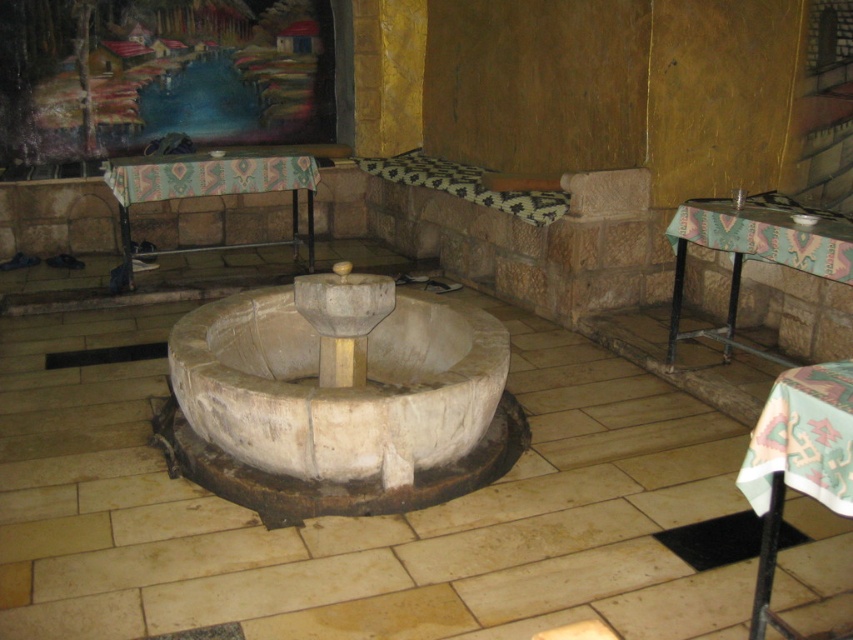
Question: Which is nearer to the patterned fabric table at lower right?

Choices:
 (A) teal woven tablecloth at upper center
 (B) smooth stone fountain at center
 (C) patterned fabric table at left

Answer: (B)

Question: Which object is positioned farthest from the smooth stone fountain at center?

Choices:
 (A) patterned fabric table at left
 (B) patterned fabric table at lower right

Answer: (A)

Question: Is smooth stone fountain at center wider than teal woven tablecloth at upper center?

Choices:
 (A) yes
 (B) no

Answer: (A)

Question: Is smooth stone fountain at center closer to the viewer compared to patterned fabric table at left?

Choices:
 (A) yes
 (B) no

Answer: (A)

Question: Which object is the closest to the textured fabric table at center?

Choices:
 (A) patterned fabric table at left
 (B) smooth stone fountain at center

Answer: (B)

Question: Is the position of smooth stone fountain at center less distant than that of textured fabric table at center?

Choices:
 (A) yes
 (B) no

Answer: (A)